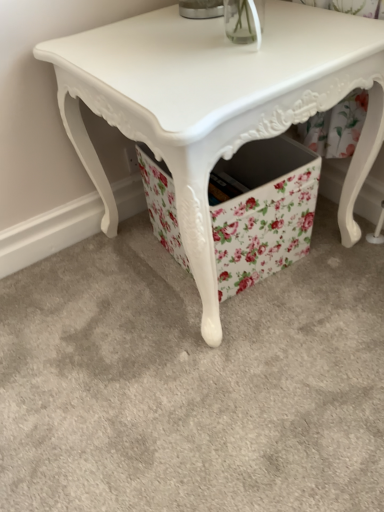
Question: Would you consider floral fabric storage box at lower center to be distant from white glossy table at center?

Choices:
 (A) no
 (B) yes

Answer: (A)

Question: From the image's perspective, does floral fabric storage box at lower center appear lower than white glossy table at center?

Choices:
 (A) yes
 (B) no

Answer: (A)

Question: Considering the relative sizes of floral fabric storage box at lower center and white glossy table at center in the image provided, is floral fabric storage box at lower center smaller than white glossy table at center?

Choices:
 (A) yes
 (B) no

Answer: (A)

Question: Is the position of floral fabric storage box at lower center less distant than that of white glossy table at center?

Choices:
 (A) no
 (B) yes

Answer: (A)

Question: Is floral fabric storage box at lower center oriented away from white glossy table at center?

Choices:
 (A) no
 (B) yes

Answer: (B)

Question: Considering the relative positions of floral fabric storage box at lower center and white glossy table at center in the image provided, is floral fabric storage box at lower center behind white glossy table at center?

Choices:
 (A) no
 (B) yes

Answer: (B)

Question: Is white glossy table at center positioned beyond the bounds of floral fabric storage box at lower center?

Choices:
 (A) yes
 (B) no

Answer: (A)

Question: Is white glossy table at center smaller than floral fabric storage box at lower center?

Choices:
 (A) no
 (B) yes

Answer: (A)

Question: Is white glossy table at center far away from floral fabric storage box at lower center?

Choices:
 (A) no
 (B) yes

Answer: (A)

Question: Is the position of white glossy table at center less distant than that of floral fabric storage box at lower center?

Choices:
 (A) yes
 (B) no

Answer: (A)

Question: Is white glossy table at center to the right of floral fabric storage box at lower center from the viewer's perspective?

Choices:
 (A) no
 (B) yes

Answer: (A)

Question: From a real-world perspective, is white glossy table at center located higher than floral fabric storage box at lower center?

Choices:
 (A) yes
 (B) no

Answer: (A)

Question: In terms of height, does white glossy table at center look taller or shorter compared to floral fabric storage box at lower center?

Choices:
 (A) short
 (B) tall

Answer: (B)